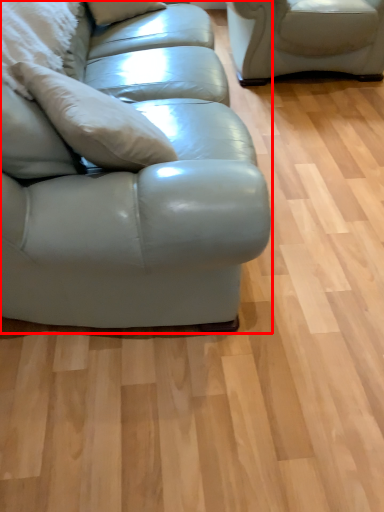
Question: From the image's perspective, what is the correct spatial relationship of studio couch (annotated by the red box) in relation to pillow?

Choices:
 (A) above
 (B) below

Answer: (B)